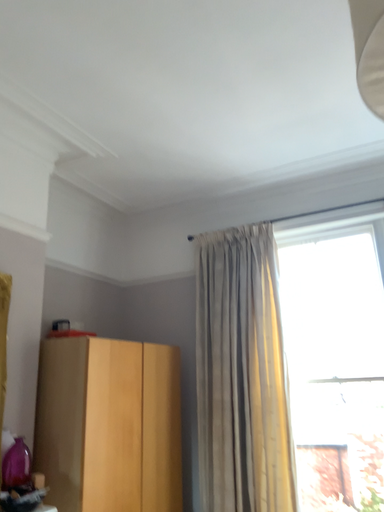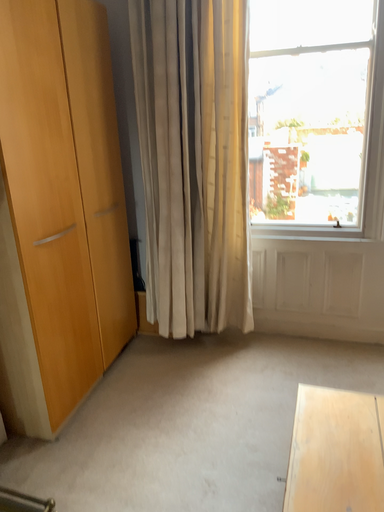
Question: How did the camera likely rotate when shooting the video?

Choices:
 (A) rotated downward
 (B) rotated upward

Answer: (A)